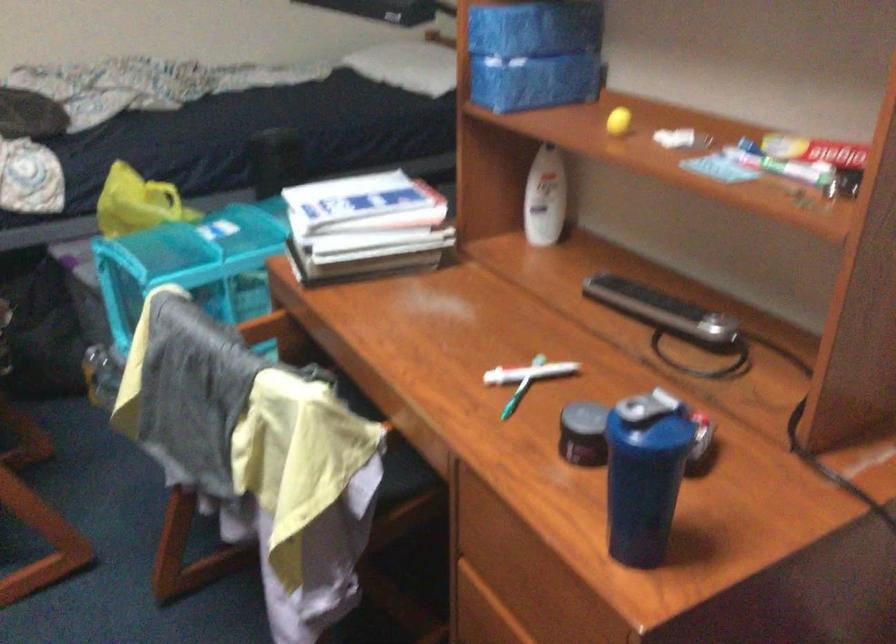
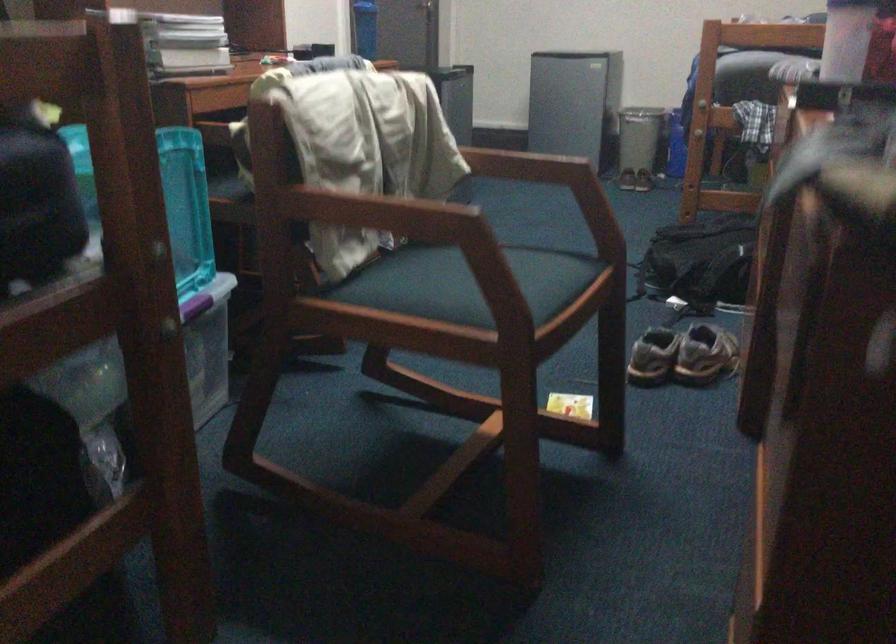
In the second image, find the point that corresponds to pixel 576 480 in the first image.

(365, 28)